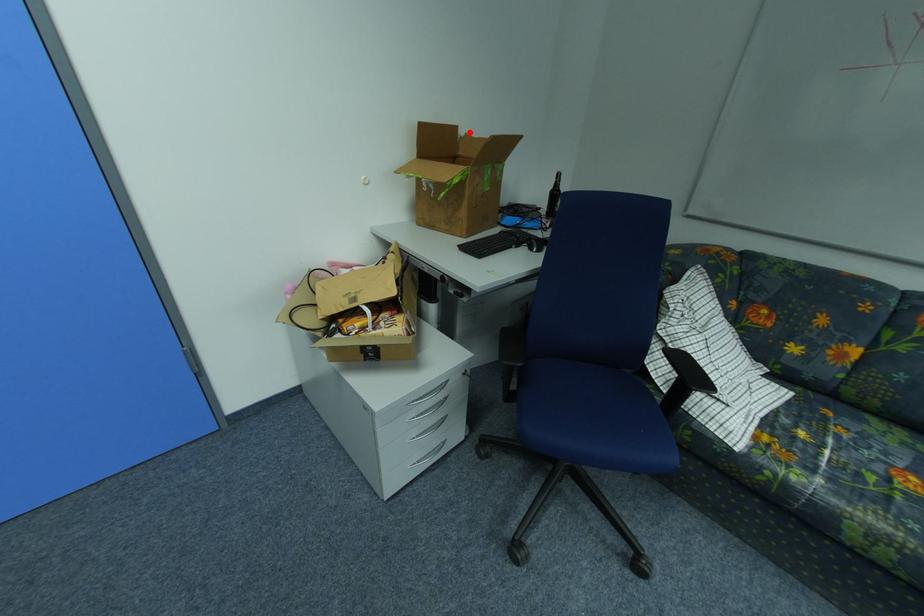
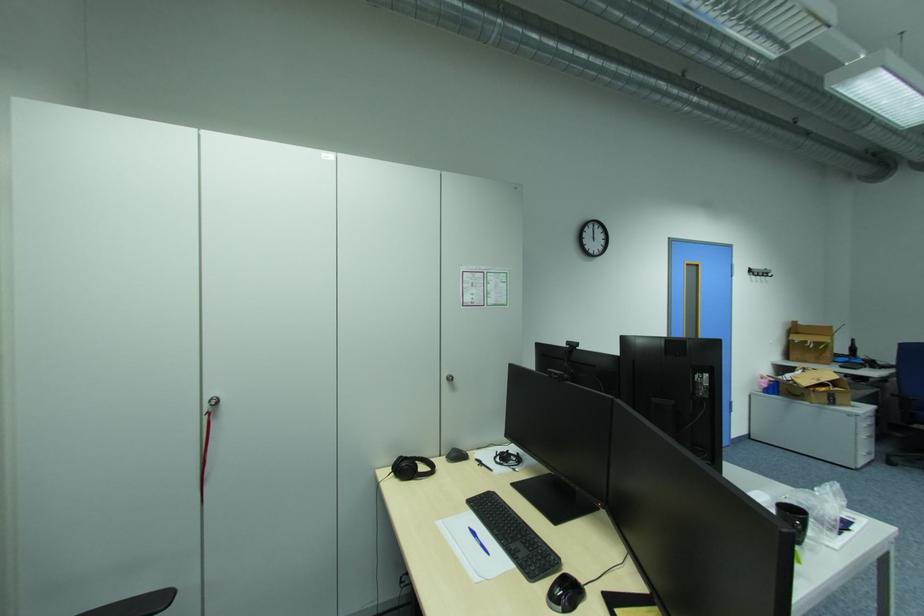
The point at the highlighted location is marked in the first image. Where is the corresponding point in the second image?

(808, 323)